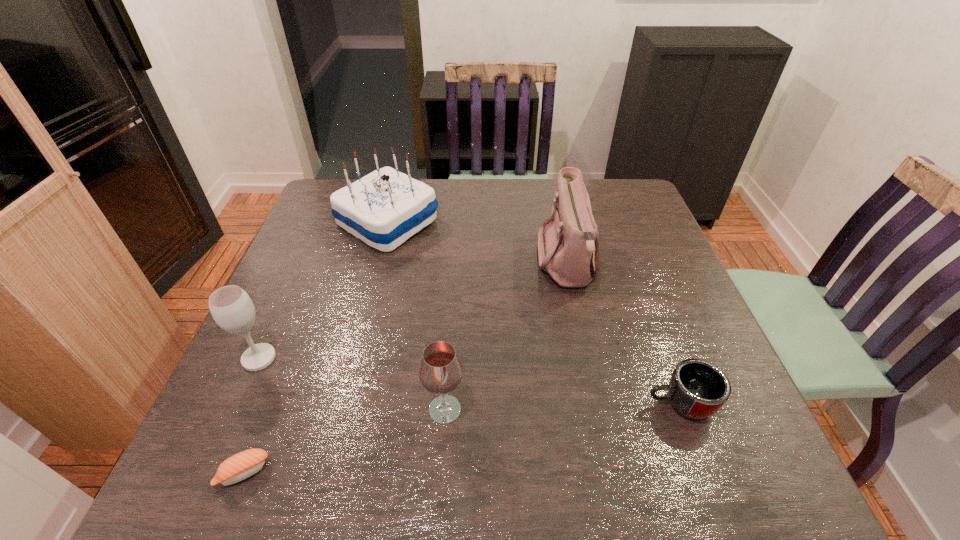
Find the location of a particular element. Image resolution: width=960 pixels, height=540 pixels. free space located 0.210m on the right of the birthday cake is located at coordinates (511, 222).

Find the location of `vacant area situated 0.150m on the front pocket of the second object from right to left`. vacant area situated 0.150m on the front pocket of the second object from right to left is located at coordinates (480, 263).

Identify the location of free space located on the front pocket of the second object from right to left. pos(462,263).

At what (x,y) coordinates should I click in order to perform the action: click on vacant space located 0.360m on the front pocket of the second object from right to left. Please return your answer as a coordinate pair (x, y). The height and width of the screenshot is (540, 960). Looking at the image, I should click on (401, 263).

What are the coordinates of `vacant space located 0.300m on the right of the left wineglass` in the screenshot? It's located at (416, 358).

At what (x,y) coordinates should I click in order to perform the action: click on free region located on the right of the nearer wineglass. Please return your answer as a coordinate pair (x, y). Looking at the image, I should click on (558, 409).

The height and width of the screenshot is (540, 960). Identify the location of free space located on the side of the fifth tallest object with the handle. (585, 403).

This screenshot has width=960, height=540. In order to click on vacant space located on the side of the fifth tallest object with the handle in this screenshot , I will do `click(523, 403)`.

I want to click on blank space located 0.280m on the side of the fifth tallest object with the handle, so click(503, 403).

This screenshot has height=540, width=960. In order to click on free space located on the back of the sushi in this screenshot , I will do `click(310, 302)`.